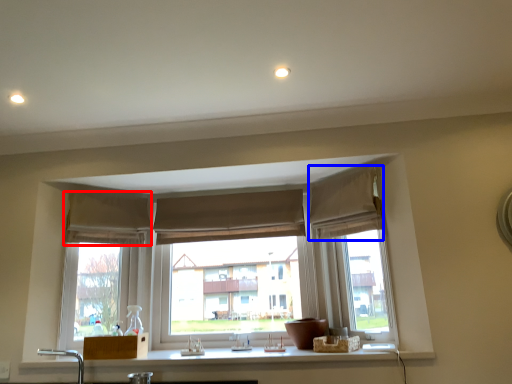
Question: Which object appears closest to the camera in this image, curtain (highlighted by a red box) or curtain (highlighted by a blue box)?

Choices:
 (A) curtain
 (B) curtain

Answer: (B)